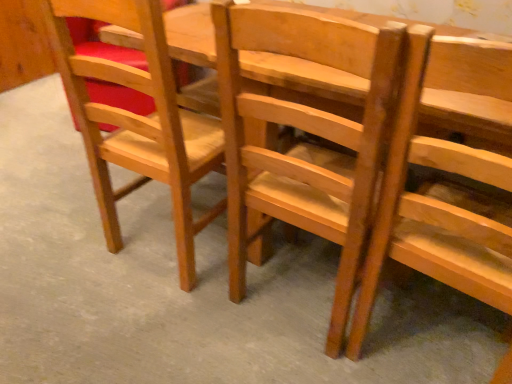
Question: Which is correct: light brown wood chair at center, the 2th chair in the left-to-right sequence, is inside wooden chair at center, the 1th chair in the right-to-left sequence, or outside of it?

Choices:
 (A) inside
 (B) outside

Answer: (B)

Question: Considering the relative positions of light brown wood chair at center, the 2th chair in the left-to-right sequence, and wooden chair at center, the 3th chair viewed from the left, in the image provided, is light brown wood chair at center, the 2th chair in the left-to-right sequence, to the left or to the right of wooden chair at center, the 3th chair viewed from the left,?

Choices:
 (A) right
 (B) left

Answer: (B)

Question: Considering the real-world distances, which object is farthest from the light brown wood chair at center, the 2th chair in the left-to-right sequence?

Choices:
 (A) matte wood chair at left, the first chair in the left-to-right sequence
 (B) wooden chair at center, the 3th chair viewed from the left

Answer: (A)

Question: Which object is the closest to the light brown wood chair at center, the 2th chair in the left-to-right sequence?

Choices:
 (A) matte wood chair at left, the first chair in the left-to-right sequence
 (B) wooden chair at center, the 3th chair viewed from the left

Answer: (B)